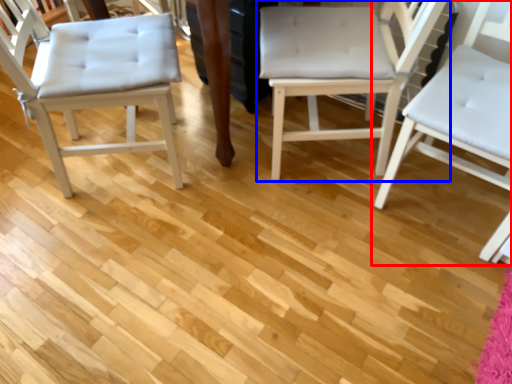
Question: Which object appears closest to the camera in this image, chair (highlighted by a red box) or chair (highlighted by a blue box)?

Choices:
 (A) chair
 (B) chair

Answer: (A)